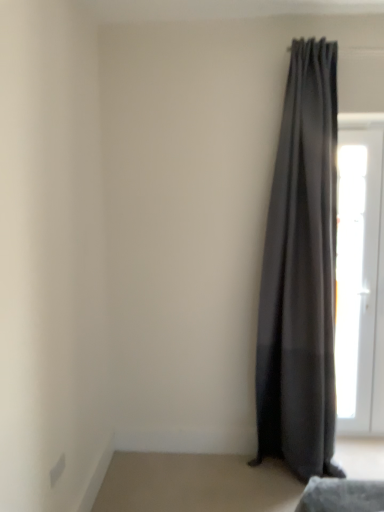
The image size is (384, 512). I want to click on vacant location below dark gray sheer curtain at right (from a real-world perspective), so click(277, 472).